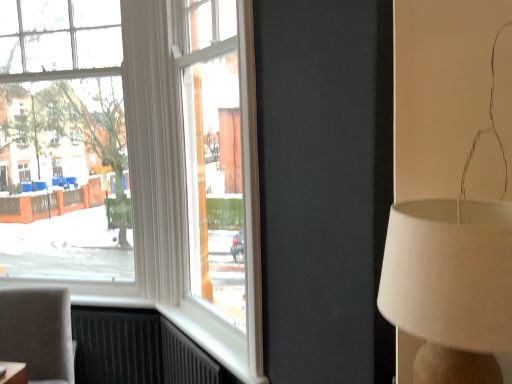
Question: Is the surface of clear glass window at left in direct contact with matte gray chair at lower left?

Choices:
 (A) yes
 (B) no

Answer: (B)

Question: From a real-world perspective, is clear glass window at left below matte gray chair at lower left?

Choices:
 (A) yes
 (B) no

Answer: (B)

Question: Can you confirm if clear glass window at left is taller than matte gray chair at lower left?

Choices:
 (A) yes
 (B) no

Answer: (A)

Question: Is clear glass window at left located outside matte gray chair at lower left?

Choices:
 (A) no
 (B) yes

Answer: (B)

Question: Is clear glass window at left shorter than matte gray chair at lower left?

Choices:
 (A) yes
 (B) no

Answer: (B)

Question: Is white fabric lampshade at right bigger or smaller than clear glass window at left?

Choices:
 (A) big
 (B) small

Answer: (B)

Question: Considering their positions, is white fabric lampshade at right located in front of or behind clear glass window at left?

Choices:
 (A) behind
 (B) front

Answer: (B)

Question: Is white fabric lampshade at right inside the boundaries of clear glass window at left, or outside?

Choices:
 (A) outside
 (B) inside

Answer: (A)

Question: Is white fabric lampshade at right wider or thinner than clear glass window at left?

Choices:
 (A) thin
 (B) wide

Answer: (B)

Question: In terms of height, does white fabric lampshade at right look taller or shorter compared to matte gray chair at lower left?

Choices:
 (A) short
 (B) tall

Answer: (A)

Question: Would you say white fabric lampshade at right is inside or outside matte gray chair at lower left?

Choices:
 (A) inside
 (B) outside

Answer: (B)

Question: From the image's perspective, relative to matte gray chair at lower left, is white fabric lampshade at right above or below?

Choices:
 (A) above
 (B) below

Answer: (A)

Question: Does point (422, 274) appear closer or farther from the camera than point (45, 367)?

Choices:
 (A) farther
 (B) closer

Answer: (B)

Question: Is point (109, 258) closer or farther from the camera than point (480, 352)?

Choices:
 (A) closer
 (B) farther

Answer: (B)

Question: In the image, is clear glass window at left positioned in front of or behind white fabric lampshade at right?

Choices:
 (A) front
 (B) behind

Answer: (B)